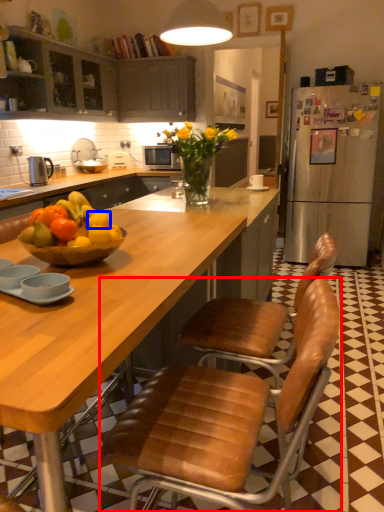
Question: Which object is further to the camera taking this photo, chair (highlighted by a red box) or orange (highlighted by a blue box)?

Choices:
 (A) chair
 (B) orange

Answer: (B)